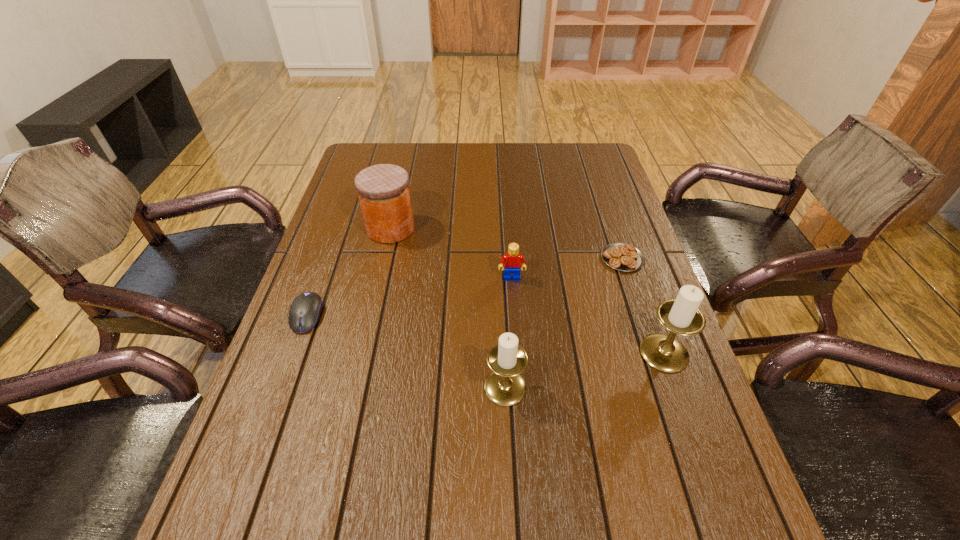
Locate an element on the screen. The height and width of the screenshot is (540, 960). the left candle holder is located at coordinates (504, 386).

Locate an element on the screen. the taller candle holder is located at coordinates [681, 316].

In order to click on the right candle holder in this screenshot , I will do `click(681, 316)`.

The height and width of the screenshot is (540, 960). I want to click on computer mouse, so click(x=305, y=310).

This screenshot has height=540, width=960. I want to click on the fifth tallest object, so click(305, 310).

Image resolution: width=960 pixels, height=540 pixels. I want to click on jar, so click(383, 190).

This screenshot has width=960, height=540. What are the coordinates of `the second object from left to right` in the screenshot? It's located at (383, 190).

Find the location of a particular element. This screenshot has width=960, height=540. Lego is located at coordinates (511, 261).

Locate an element on the screen. the fourth tallest object is located at coordinates (511, 261).

Locate an element on the screen. This screenshot has height=540, width=960. the second farthest object is located at coordinates (621, 256).